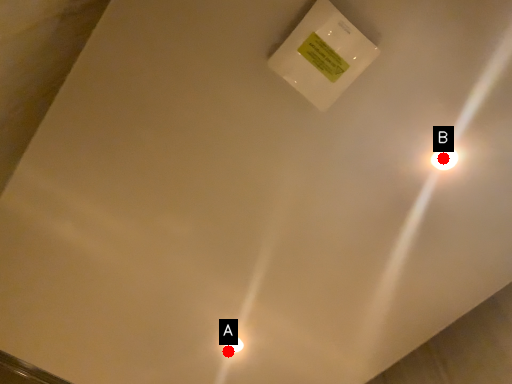
Question: Two points are circled on the image, labeled by A and B beside each circle. Which of the following is the farthest from the observer?

Choices:
 (A) A is further
 (B) B is further

Answer: (A)